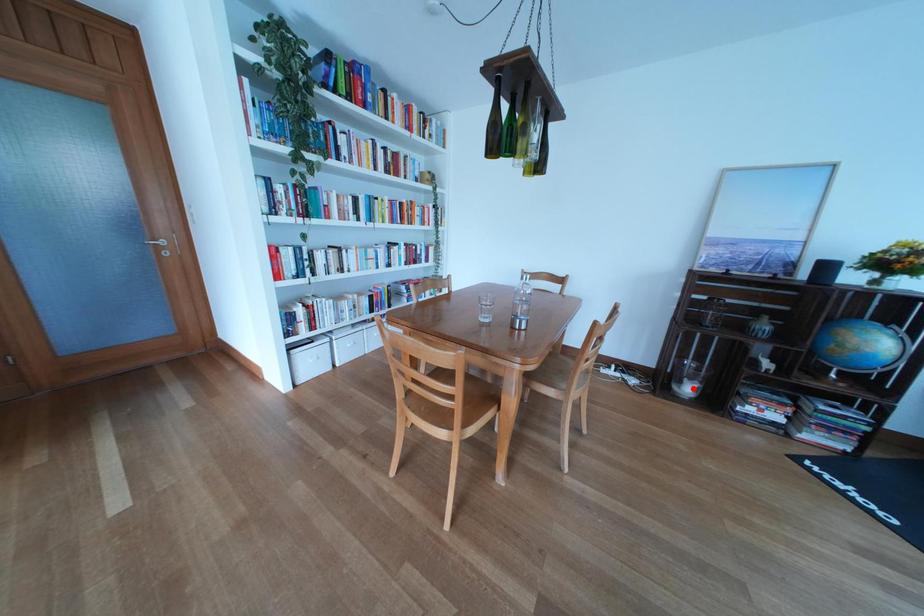
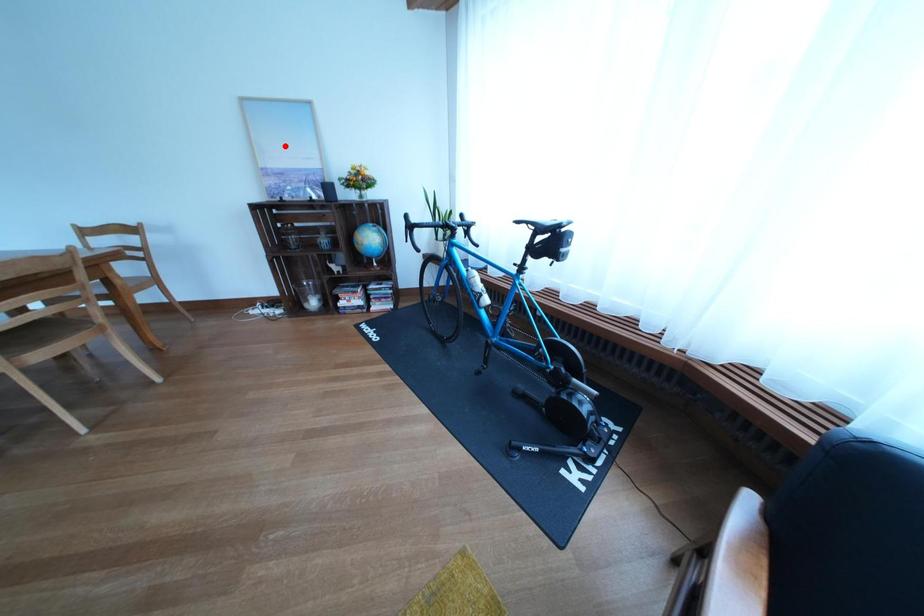
I am providing you with two images of the same scene from different viewpoints. A red point is marked on the first image and another point is marked on the second image. Does the point marked in image1 correspond to the same location as the one in image2?

No